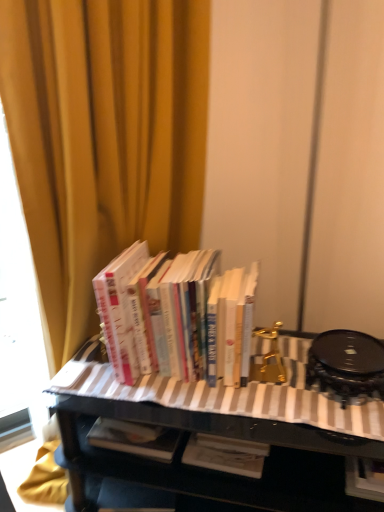
Measure the distance between point (114,122) and camera.

The depth of point (114,122) is 3.42 feet.

What is the approximate height of black glossy table at center?

black glossy table at center is 19.08 inches tall.

Where is `yellow fabric curtain at upper left`? The height and width of the screenshot is (512, 384). yellow fabric curtain at upper left is located at coordinates (103, 138).

Is black glossy table at center directly adjacent to yellow fabric curtain at upper left?

They are not placed beside each other.

Is black glossy table at center facing away from yellow fabric curtain at upper left?

Yes, black glossy table at center is facing away from yellow fabric curtain at upper left.

Does point (169, 480) come farther from viewer compared to point (198, 186)?

No, it is not.

Where is `table that appears behind the yellow fabric curtain at upper left`? Image resolution: width=384 pixels, height=512 pixels. table that appears behind the yellow fabric curtain at upper left is located at coordinates (224, 436).

Considering the points (104, 42) and (213, 275), which point is behind, point (104, 42) or point (213, 275)?

The point (213, 275) is more distant.

Is yellow fabric curtain at upper left positioned with its back to hardcover books at center?

That's right, yellow fabric curtain at upper left is facing away from hardcover books at center.

Where is `curtain lying above the hardcover books at center (from the image's perspective)`? Image resolution: width=384 pixels, height=512 pixels. curtain lying above the hardcover books at center (from the image's perspective) is located at coordinates (103, 138).

Can you confirm if yellow fabric curtain at upper left is wider than hardcover books at center?

Yes.

The height and width of the screenshot is (512, 384). I want to click on curtain located above the black glossy table at center (from a real-world perspective), so click(x=103, y=138).

From a real-world perspective, is yellow fabric curtain at upper left positioned above or below black glossy table at center?

yellow fabric curtain at upper left is above black glossy table at center.

From the image's perspective, which object appears higher, yellow fabric curtain at upper left or black glossy table at center?

From the image's view, yellow fabric curtain at upper left is above.

Does black glossy table at center have a lesser width compared to hardcover books at center?

No.

Which object is closer to the camera taking this photo, black glossy table at center or hardcover books at center?

black glossy table at center is closer to the camera.

From the image's perspective, between black glossy table at center and hardcover books at center, who is located below?

black glossy table at center is shown below in the image.

Is black glossy table at center situated inside hardcover books at center or outside?

black glossy table at center is spatially situated outside hardcover books at center.

From the image's perspective, between hardcover books at center and yellow fabric curtain at upper left, which one is located above?

From the image's view, yellow fabric curtain at upper left is above.

Image resolution: width=384 pixels, height=512 pixels. I want to click on curtain above the hardcover books at center (from a real-world perspective), so click(x=103, y=138).

From the picture: Is hardcover books at center wider or thinner than yellow fabric curtain at upper left?

Clearly, hardcover books at center has less width compared to yellow fabric curtain at upper left.

Considering the relative positions of hardcover books at center and black glossy table at center in the image provided, is hardcover books at center to the right of black glossy table at center from the viewer's perspective?

No.

From the picture: Which of these two, hardcover books at center or black glossy table at center, is wider?

black glossy table at center.

Would you say hardcover books at center is outside black glossy table at center?

Yes, hardcover books at center is outside of black glossy table at center.

Is the position of hardcover books at center less distant than that of black glossy table at center?

No, the depth of hardcover books at center is greater than that of black glossy table at center.

Where is `curtain above the black glossy table at center (from the image's perspective)`? The height and width of the screenshot is (512, 384). curtain above the black glossy table at center (from the image's perspective) is located at coordinates (103, 138).

Locate an element on the screen. Image resolution: width=384 pixels, height=512 pixels. curtain in front of the hardcover books at center is located at coordinates (103, 138).

Which object lies nearer to the anchor point yellow fabric curtain at upper left, black glossy table at center or hardcover books at center?

hardcover books at center is closer to yellow fabric curtain at upper left.

From the image, which object appears to be nearer to hardcover books at center, yellow fabric curtain at upper left or black glossy table at center?

black glossy table at center is positioned closer to the anchor hardcover books at center.

Estimate the real-world distances between objects in this image. Which object is closer to hardcover books at center, black glossy table at center or yellow fabric curtain at upper left?

black glossy table at center lies closer to hardcover books at center than the other object.

From the image, which object appears to be farther from yellow fabric curtain at upper left, hardcover books at center or black glossy table at center?

The object further to yellow fabric curtain at upper left is black glossy table at center.

Based on their spatial positions, is yellow fabric curtain at upper left or hardcover books at center further from black glossy table at center?

yellow fabric curtain at upper left.

When comparing their distances from black glossy table at center, does hardcover books at center or yellow fabric curtain at upper left seem further?

yellow fabric curtain at upper left is positioned further to the anchor black glossy table at center.

You are a GUI agent. You are given a task and a screenshot of the screen. Output one action in this format:
    pyautogui.click(x=<x>, y=<y>)
    Task: Click on the book between yellow fabric curtain at upper left and black glossy table at center in the vertical direction
    The width and height of the screenshot is (384, 512).
    Given the screenshot: What is the action you would take?
    pyautogui.click(x=174, y=315)